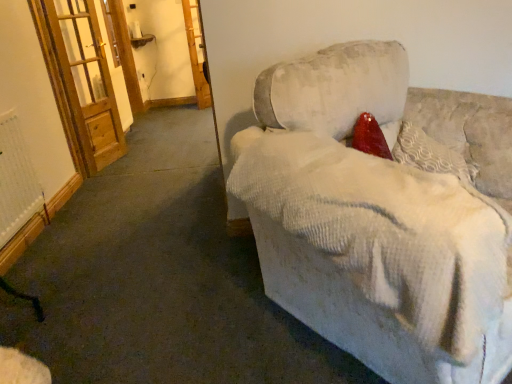
Question: Is wooden screen door at upper left, the 2th screen door from the front, positioned beyond the bounds of velvet beige couch at center?

Choices:
 (A) no
 (B) yes

Answer: (B)

Question: Is wooden screen door at upper left, the 2th screen door from the front, in front of velvet beige couch at center?

Choices:
 (A) yes
 (B) no

Answer: (B)

Question: Is wooden screen door at upper left, which is counted as the second screen door, starting from the left, looking in the opposite direction of velvet beige couch at center?

Choices:
 (A) no
 (B) yes

Answer: (A)

Question: Is wooden screen door at upper left, which is counted as the second screen door, starting from the left, to the left of velvet beige couch at center from the viewer's perspective?

Choices:
 (A) no
 (B) yes

Answer: (B)

Question: Is wooden screen door at upper left, which is counted as the second screen door, starting from the left, bigger than velvet beige couch at center?

Choices:
 (A) yes
 (B) no

Answer: (B)

Question: Does wooden screen door at upper left, which is counted as the second screen door, starting from the left, have a smaller size compared to velvet beige couch at center?

Choices:
 (A) no
 (B) yes

Answer: (B)

Question: Is velvet beige couch at center located within textured cream pillow at upper right?

Choices:
 (A) yes
 (B) no

Answer: (B)

Question: Does textured cream pillow at upper right lie in front of velvet beige couch at center?

Choices:
 (A) no
 (B) yes

Answer: (A)

Question: Is textured cream pillow at upper right outside velvet beige couch at center?

Choices:
 (A) no
 (B) yes

Answer: (A)

Question: Considering the relative positions of textured cream pillow at upper right and velvet beige couch at center in the image provided, is textured cream pillow at upper right to the left of velvet beige couch at center from the viewer's perspective?

Choices:
 (A) no
 (B) yes

Answer: (A)

Question: From a real-world perspective, is textured cream pillow at upper right beneath velvet beige couch at center?

Choices:
 (A) yes
 (B) no

Answer: (B)

Question: From the image's perspective, is textured cream pillow at upper right on top of velvet beige couch at center?

Choices:
 (A) no
 (B) yes

Answer: (B)

Question: Can you confirm if textured cream pillow at upper right is shorter than white textured radiator at lower left?

Choices:
 (A) yes
 (B) no

Answer: (A)